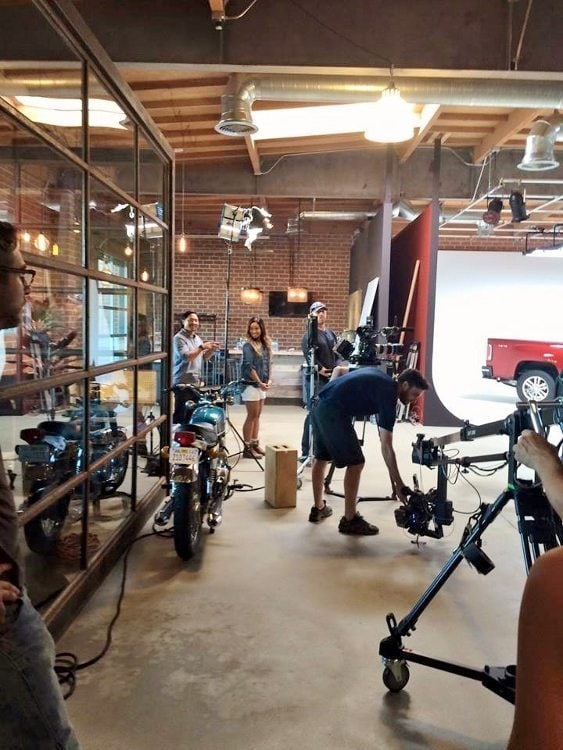
Find the location of `tv`. tv is located at coordinates (283, 303).